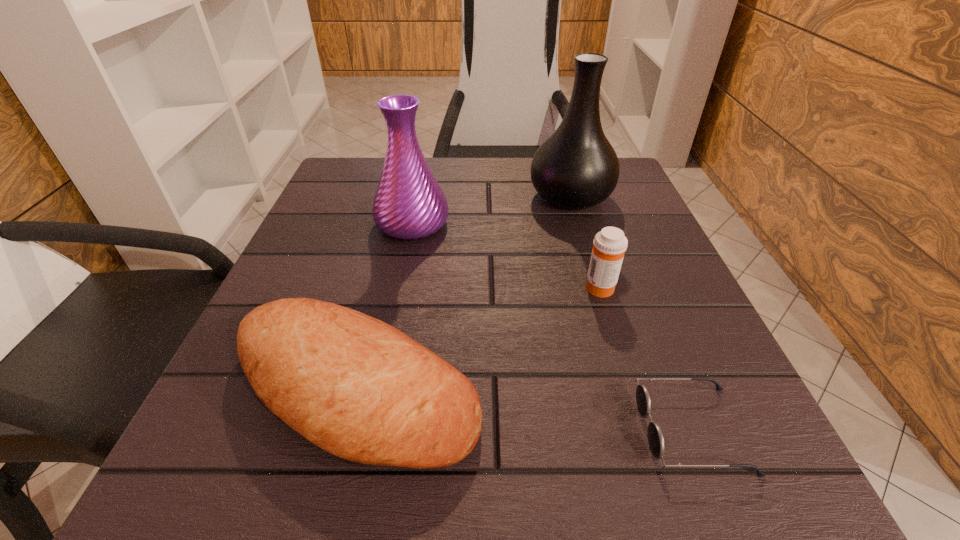
Locate an element on the screen. vacant region between the third nearest object and the shortest object is located at coordinates (646, 358).

Identify the location of vacant point located between the left vase and the sunglasses. The height and width of the screenshot is (540, 960). coord(552,327).

Find the location of a particular element. vacant area that lies between the third nearest object and the bread is located at coordinates (478, 338).

Find the location of a particular element. The image size is (960, 540). vacant space in between the right vase and the sunglasses is located at coordinates (632, 314).

Locate an element on the screen. This screenshot has height=540, width=960. vacant area between the sunglasses and the third farthest object is located at coordinates (646, 358).

Image resolution: width=960 pixels, height=540 pixels. In order to click on vacant area that lies between the shorter vase and the third nearest object in this screenshot , I will do point(506,255).

Where is `free space between the second tallest object and the sunglasses`? free space between the second tallest object and the sunglasses is located at coordinates (552, 327).

At what (x,y) coordinates should I click in order to perform the action: click on vacant region between the medicine and the right vase. Please return your answer as a coordinate pair (x, y). Looking at the image, I should click on click(585, 242).

You are a GUI agent. You are given a task and a screenshot of the screen. Output one action in this format:
    pyautogui.click(x=<x>, y=<y>)
    Task: Click on the empty space between the right vase and the fourth shortest object
    Image resolution: width=960 pixels, height=540 pixels.
    Given the screenshot: What is the action you would take?
    pyautogui.click(x=492, y=211)

Find the location of a particular element. This screenshot has height=540, width=960. object that ranks as the closest to the third nearest object is located at coordinates (576, 167).